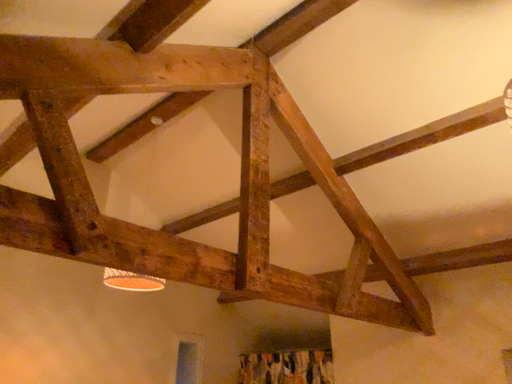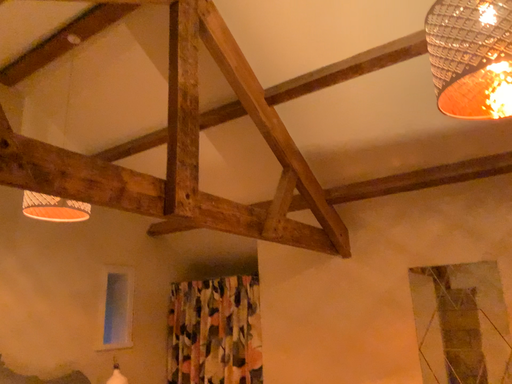
Question: Which way did the camera rotate in the video?

Choices:
 (A) rotated left
 (B) rotated right

Answer: (B)